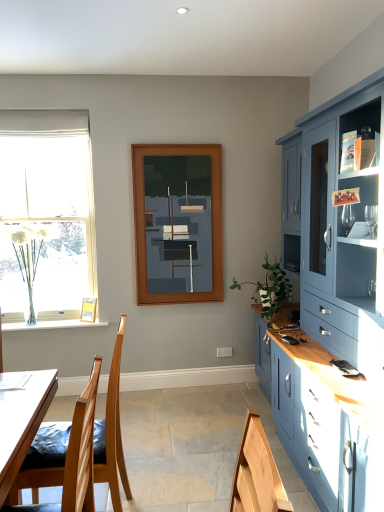
The width and height of the screenshot is (384, 512). Identify the location of matte wooden frame at center. (178, 223).

Image resolution: width=384 pixels, height=512 pixels. What do you see at coordinates (270, 289) in the screenshot?
I see `green leafy plant at right` at bounding box center [270, 289].

The image size is (384, 512). I want to click on wooden chair at lower left, so click(x=112, y=432).

Considering the relative positions of wooden picture frame at lower left and clear glass vase at left in the image provided, is wooden picture frame at lower left to the right of clear glass vase at left from the viewer's perspective?

Yes, wooden picture frame at lower left is to the right of clear glass vase at left.

From a real-world perspective, which object stands above the other?

clear glass vase at left is physically above.

Between wooden picture frame at lower left and clear glass vase at left, which one has larger width?

Wider between the two is clear glass vase at left.

Consider the image. Is wooden picture frame at lower left in front of clear glass vase at left?

No.

Does point (107, 420) come farther from viewer compared to point (87, 307)?

No, it is not.

Is wooden chair at lower left not inside wooden picture frame at lower left?

wooden chair at lower left is positioned outside wooden picture frame at lower left.

Is wooden chair at lower left not near wooden picture frame at lower left?

wooden chair at lower left is far away from wooden picture frame at lower left.

Which point is more distant from viewer, (x=188, y=271) or (x=89, y=304)?

The point (x=89, y=304) is farther.

Is matte wooden frame at center positioned with its back to wooden picture frame at lower left?

matte wooden frame at center is not turned away from wooden picture frame at lower left.

From a real-world perspective, is matte wooden frame at center on wooden picture frame at lower left?

Yes, from a real-world perspective, matte wooden frame at center is on top of wooden picture frame at lower left.

Which object is thinner, green leafy plant at right or wooden picture frame at lower left?

wooden picture frame at lower left.

Is green leafy plant at right in contact with wooden picture frame at lower left?

There is a gap between green leafy plant at right and wooden picture frame at lower left.

Can you tell me how much green leafy plant at right and wooden picture frame at lower left differ in facing direction?

The angle between the facing direction of green leafy plant at right and the facing direction of wooden picture frame at lower left is 61.5 degrees.

Which is nearer, (285,296) or (84,298)?

Point (285,296).

Between clear glass vase at left and white fabric curtain at upper left, which one has smaller size?

Smaller between the two is white fabric curtain at upper left.

Is clear glass vase at left located outside white fabric curtain at upper left?

clear glass vase at left lies outside white fabric curtain at upper left's area.

Between clear glass vase at left and white fabric curtain at upper left, which one is positioned behind?

white fabric curtain at upper left is behind.

Considering the relative sizes of matte wooden frame at center and green leafy plant at right in the image provided, is matte wooden frame at center smaller than green leafy plant at right?

Correct, matte wooden frame at center occupies less space than green leafy plant at right.

Considering the points (155, 176) and (267, 282), which point is in front, point (155, 176) or point (267, 282)?

The point (155, 176) is more forward.

Based on the photo, is white fabric curtain at upper left in front of or behind wooden picture frame at lower left in the image?

In the image, white fabric curtain at upper left appears in front of wooden picture frame at lower left.

From a real-world perspective, is white fabric curtain at upper left located higher than wooden picture frame at lower left?

Indeed, from a real-world perspective, white fabric curtain at upper left stands above wooden picture frame at lower left.

Considering the relative sizes of white fabric curtain at upper left and wooden picture frame at lower left in the image provided, is white fabric curtain at upper left bigger than wooden picture frame at lower left?

Yes.

In order to click on picture frame on the right of clear glass vase at left in this screenshot , I will do `click(88, 309)`.

Where is `chair in front of the wooden picture frame at lower left`? chair in front of the wooden picture frame at lower left is located at coordinates (112, 432).

Which object lies further to the anchor point wooden chair at lower left, clear glass vase at left or white fabric curtain at upper left?

The object further to wooden chair at lower left is white fabric curtain at upper left.

Based on their spatial positions, is clear glass vase at left or matte wooden frame at center closer to white fabric curtain at upper left?

The object closer to white fabric curtain at upper left is clear glass vase at left.

When comparing their distances from matte wooden frame at center, does wooden picture frame at lower left or white fabric curtain at upper left seem further?

white fabric curtain at upper left lies further to matte wooden frame at center than the other object.

From the image, which object appears to be farther from green leafy plant at right, wooden picture frame at lower left or white fabric curtain at upper left?

white fabric curtain at upper left lies further to green leafy plant at right than the other object.

When comparing their distances from clear glass vase at left, does green leafy plant at right or clear glass vase at left seem further?

green leafy plant at right.

Estimate the real-world distances between objects in this image. Which object is closer to clear glass vase at left, wooden chair at lower left or matte wooden frame at center?

matte wooden frame at center is closer to clear glass vase at left.

Based on their spatial positions, is wooden picture frame at lower left or matte wooden frame at center closer to white fabric curtain at upper left?

matte wooden frame at center is positioned closer to the anchor white fabric curtain at upper left.

When comparing their distances from wooden picture frame at lower left, does clear glass vase at left or clear glass vase at left seem further?

clear glass vase at left is positioned further to the anchor wooden picture frame at lower left.

Identify the location of plant that lies between white fabric curtain at upper left and wooden chair at lower left from top to bottom. This screenshot has height=512, width=384. (29, 261).

Image resolution: width=384 pixels, height=512 pixels. Find the location of `window screen between wooden chair at lower left and clear glass vase at left from front to back`. window screen between wooden chair at lower left and clear glass vase at left from front to back is located at coordinates (178, 223).

Find the location of a particular element. This screenshot has width=384, height=512. picture frame situated between clear glass vase at left and green leafy plant at right from left to right is located at coordinates [x=88, y=309].

The width and height of the screenshot is (384, 512). What are the coordinates of `window located between wooden chair at lower left and wooden picture frame at lower left in the depth direction` in the screenshot? It's located at (46, 214).